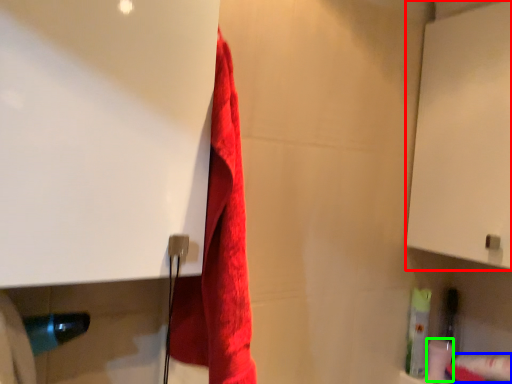
Question: Estimate the real-world distances between objects in this image. Which object is closer to screen door (highlighted by a red box), toilet paper (highlighted by a blue box) or toilet paper (highlighted by a green box)?

Choices:
 (A) toilet paper
 (B) toilet paper

Answer: (A)